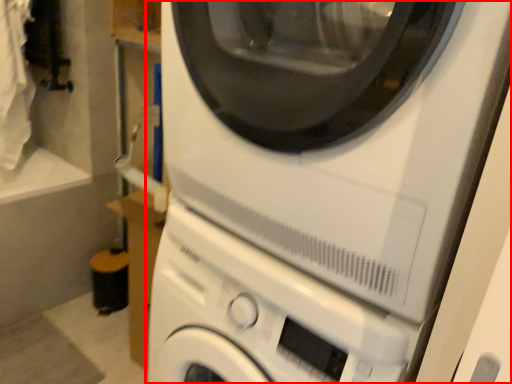
Question: Where is washing machine (annotated by the red box) located in relation to washing machine in the image?

Choices:
 (A) right
 (B) left

Answer: (A)